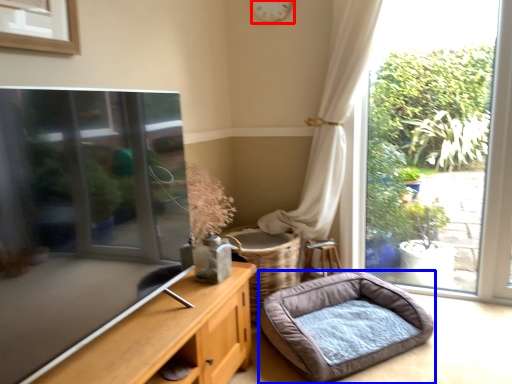
Question: Which object is further to the camera taking this photo, clock (highlighted by a red box) or dog bed (highlighted by a blue box)?

Choices:
 (A) clock
 (B) dog bed

Answer: (A)